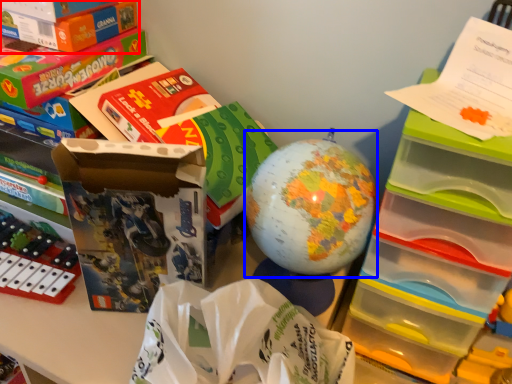
Question: Which object appears closest to the camera in this image, box (highlighted by a red box) or toy (highlighted by a blue box)?

Choices:
 (A) box
 (B) toy

Answer: (B)